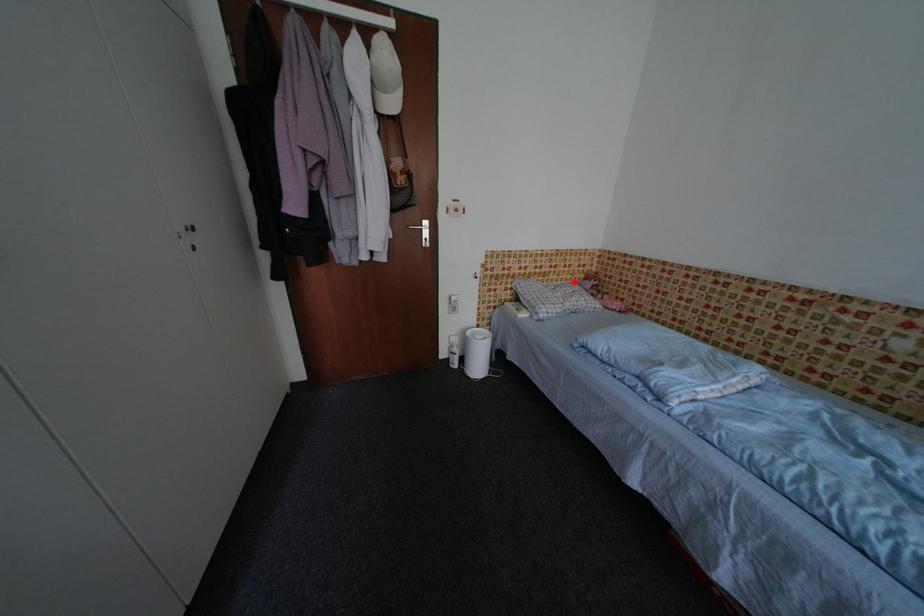
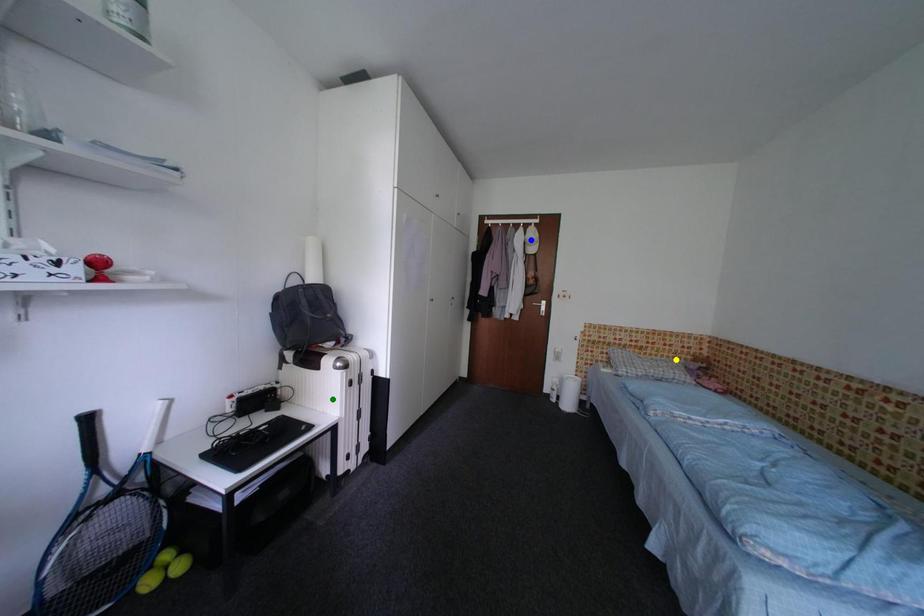
Question: I am providing you with two images of the same scene from different viewpoints. A red point is marked on the first image. You are given multiple points on the second image. Which point in image 2 represents the same 3d spot as the red point in image 1?

Choices:
 (A) green point
 (B) yellow point
 (C) blue point

Answer: (B)